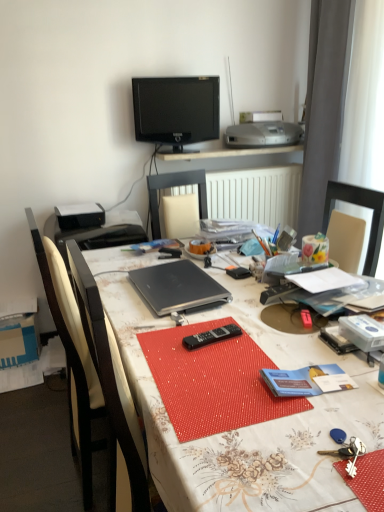
Identify the location of free spot to the left of black plastic remote at center. Image resolution: width=384 pixels, height=512 pixels. (155, 340).